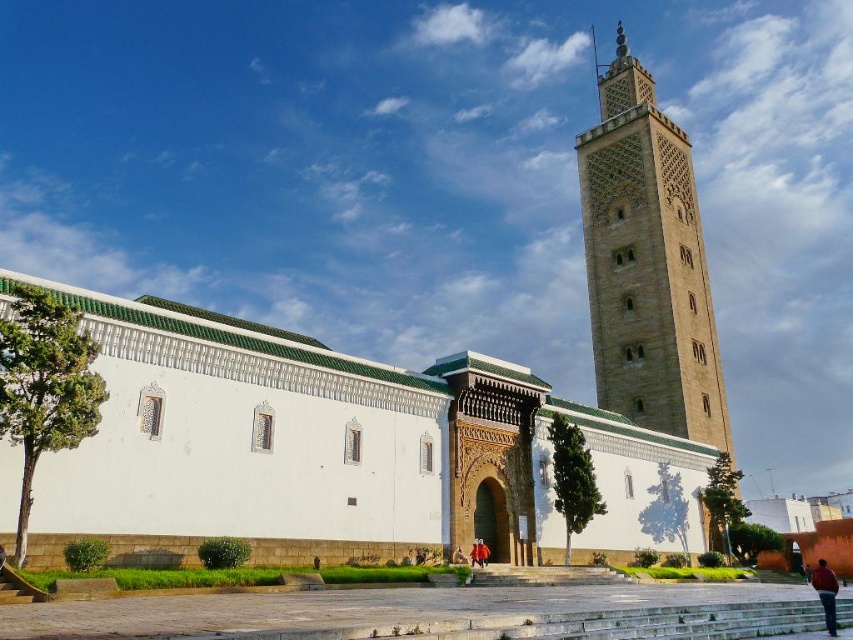
Question: Does brown stone minaret at upper right appear under brown leather jacket at lower right?

Choices:
 (A) no
 (B) yes

Answer: (A)

Question: Can you confirm if brown stone minaret at upper right is positioned to the left of brown leather jacket at lower right?

Choices:
 (A) yes
 (B) no

Answer: (B)

Question: Estimate the real-world distances between objects in this image. Which object is farther from the white textured wall at center?

Choices:
 (A) brown leather jacket at lower right
 (B) brown stone minaret at upper right

Answer: (B)

Question: Among these points, which one is nearest to the camera?

Choices:
 (A) 815,570
 (B) 648,140

Answer: (A)

Question: Which object is farther from the camera taking this photo?

Choices:
 (A) brown stone minaret at upper right
 (B) brown leather jacket at lower right
 (C) white textured wall at center

Answer: (A)

Question: Is white textured wall at center to the left of brown leather jacket at lower right from the viewer's perspective?

Choices:
 (A) yes
 (B) no

Answer: (A)